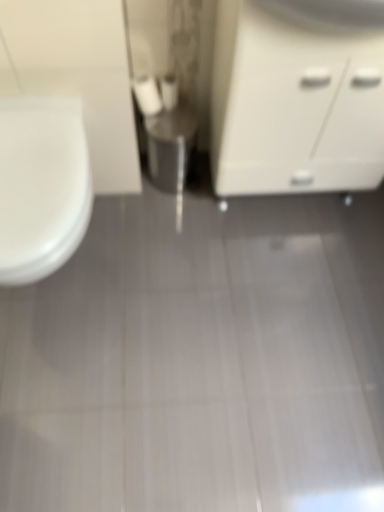
At what (x,y) coordinates should I click in order to perform the action: click on vacant region below white glossy toilet at left (from a real-world perspective). Please return your answer as a coordinate pair (x, y). The height and width of the screenshot is (512, 384). Looking at the image, I should click on (64, 281).